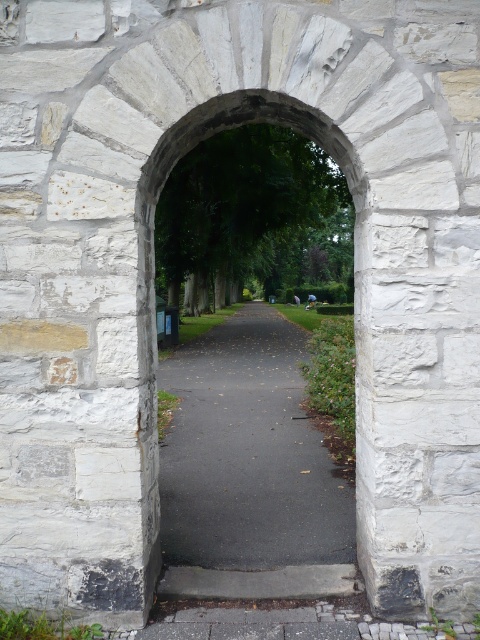
Question: Is stone archway at center wider than black asphalt path at center?

Choices:
 (A) yes
 (B) no

Answer: (A)

Question: Can you confirm if stone archway at center is positioned below black asphalt path at center?

Choices:
 (A) no
 (B) yes

Answer: (A)

Question: Does stone archway at center appear under black asphalt path at center?

Choices:
 (A) yes
 (B) no

Answer: (B)

Question: Among these objects, which one is nearest to the camera?

Choices:
 (A) stone archway at center
 (B) black asphalt path at center

Answer: (A)